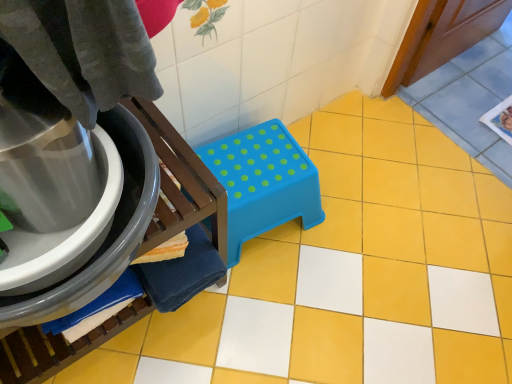
Image resolution: width=512 pixels, height=384 pixels. Identify the location of empty space that is to the right of blue plastic stool at center. (262, 323).